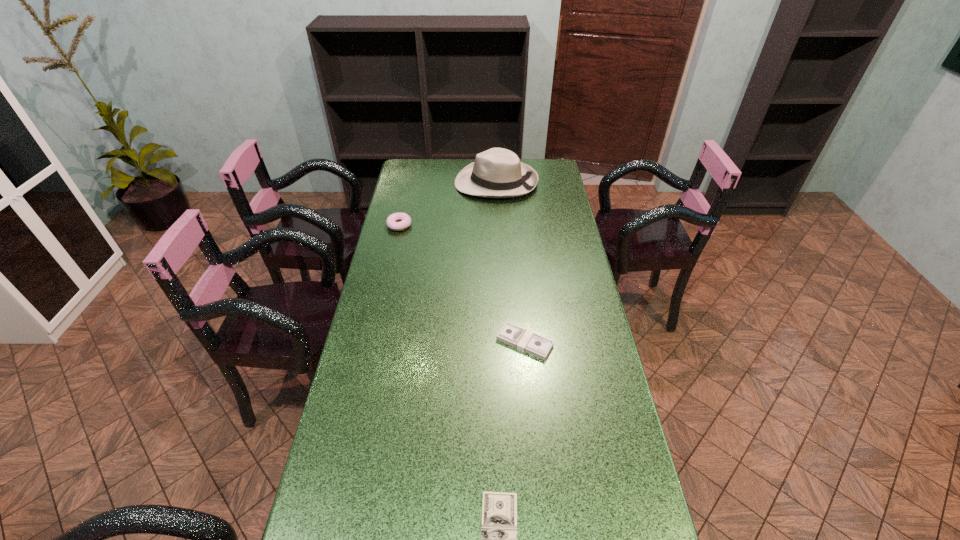
Image resolution: width=960 pixels, height=540 pixels. I want to click on vacant area at the far right corner of the desktop, so click(x=558, y=163).

The width and height of the screenshot is (960, 540). I want to click on empty space that is in between the tallest object and the third tallest object, so click(x=511, y=262).

Image resolution: width=960 pixels, height=540 pixels. Identify the location of free space between the second nearest object and the farthest object. (511, 262).

What are the coordinates of `empty space that is in between the fedora and the leftmost object` in the screenshot? It's located at (447, 204).

Image resolution: width=960 pixels, height=540 pixels. In order to click on empty location between the fedora and the taller dollar in this screenshot , I will do `click(511, 262)`.

You are a GUI agent. You are given a task and a screenshot of the screen. Output one action in this format:
    pyautogui.click(x=<x>, y=<y>)
    Task: Click on the free point between the doughnut and the fedora
    This screenshot has width=960, height=540.
    Given the screenshot: What is the action you would take?
    pyautogui.click(x=447, y=204)

This screenshot has height=540, width=960. In order to click on object that can be found as the second closest to the third nearest object in this screenshot , I will do `click(513, 335)`.

Locate an element on the screen. This screenshot has height=540, width=960. object that can be found as the third closest to the leftmost object is located at coordinates [499, 510].

I want to click on vacant space that satisfies the following two spatial constraints: 1. on the front-facing side of the taller dollar; 2. on the left side of the fedora, so click(504, 342).

In order to click on vacant position in the image that satisfies the following two spatial constraints: 1. on the front side of the taller dollar; 2. on the left side of the doughnut in this screenshot , I will do `click(373, 342)`.